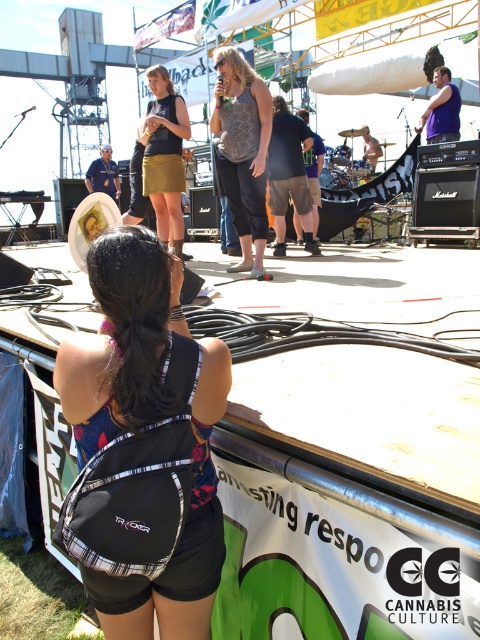
Is textured gray tank top at center smaller than gold skirt at center?

Yes.

Which is in front, point (219, 92) or point (164, 189)?

Positioned in front is point (219, 92).

At what (x,y) coordinates should I click in order to perform the action: click on textured gray tank top at center. Please return your answer as a coordinate pair (x, y). The height and width of the screenshot is (640, 480). Looking at the image, I should click on (242, 150).

Does black fabric backpack at center have a lesser width compared to gold skirt at center?

Indeed, black fabric backpack at center has a lesser width compared to gold skirt at center.

Is black fabric backpack at center further to camera compared to gold skirt at center?

That is False.

Locate an element on the screen. black fabric backpack at center is located at coordinates (143, 445).

The image size is (480, 640). I want to click on black fabric backpack at center, so [143, 445].

Does black fabric backpack at center appear on the left side of textured gray tank top at center?

Indeed, black fabric backpack at center is positioned on the left side of textured gray tank top at center.

Who is positioned more to the left, black fabric backpack at center or textured gray tank top at center?

From the viewer's perspective, black fabric backpack at center appears more on the left side.

Is point (163, 280) positioned in front of point (266, 132)?

Yes, point (163, 280) is in front of point (266, 132).

Identify the location of black fabric backpack at center. This screenshot has height=640, width=480. (143, 445).